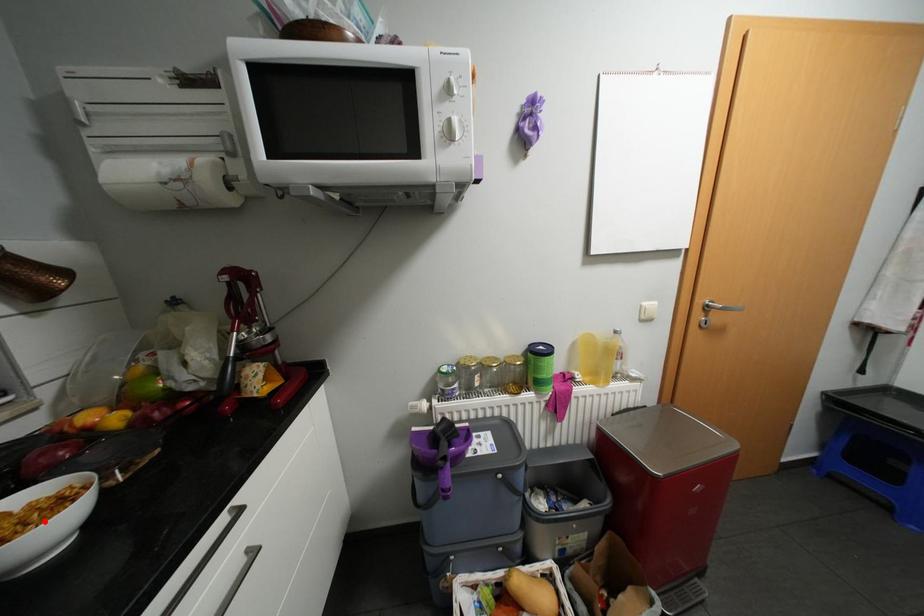
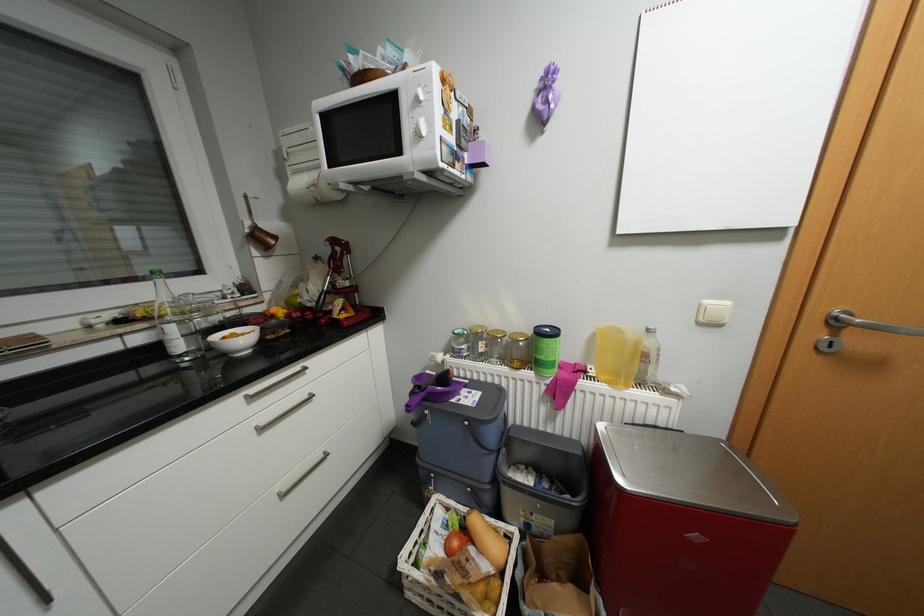
In the second image, find the point that corresponds to the highlighted location in the first image.

(249, 339)